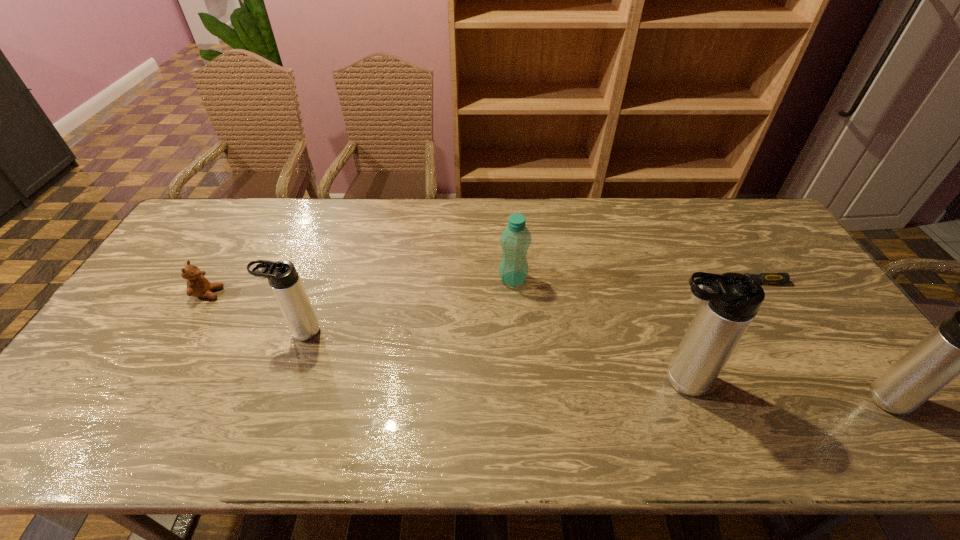
Locate which thermos bottle ranks second in proximity to the fifth shortest object. Please provide its 2D coordinates. Your answer should be formatted as a tuple, i.e. [(x, y)], where the tuple contains the x and y coordinates of a point satisfying the conditions above.

[(283, 278)]